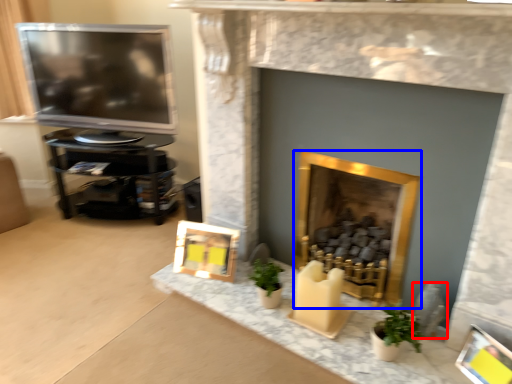
Question: Among these objects, which one is nearest to the camera, gray (highlighted by a red box) or fireplace (highlighted by a blue box)?

Choices:
 (A) gray
 (B) fireplace

Answer: (B)